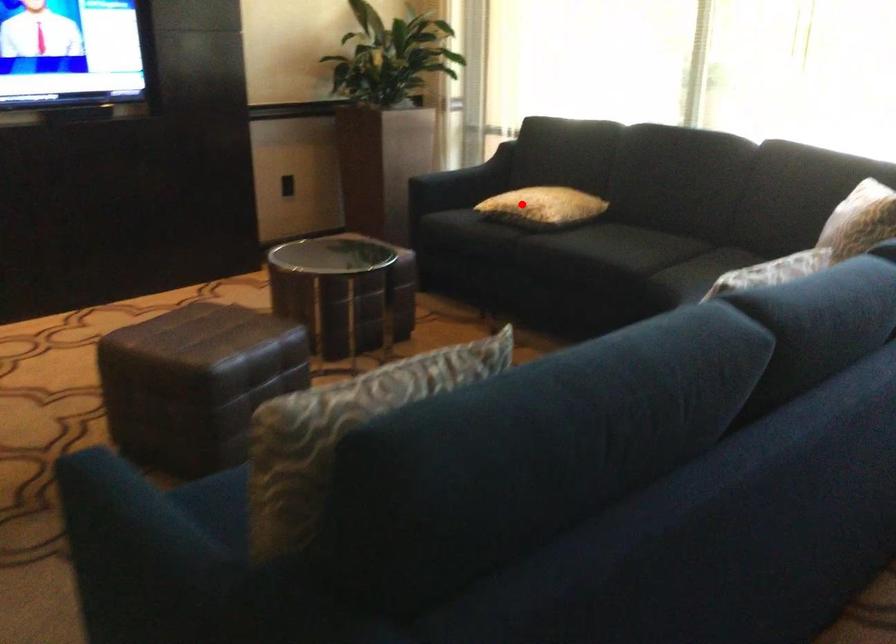
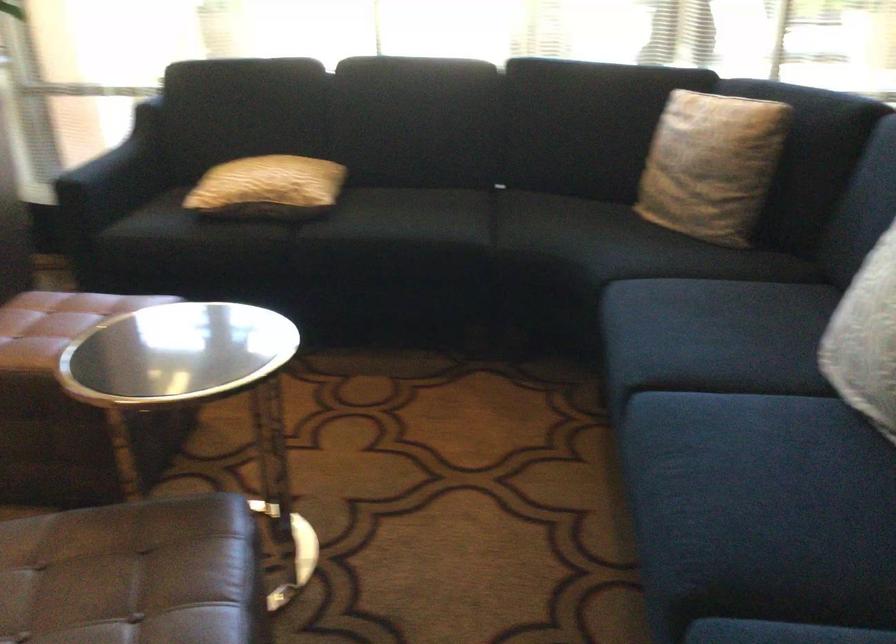
Question: I am providing you with two images of the same scene from different viewpoints. Given a red point in image1, look at the same physical point in image2. Is it:

Choices:
 (A) Closer to the viewpoint
 (B) Farther from the viewpoint

Answer: (A)